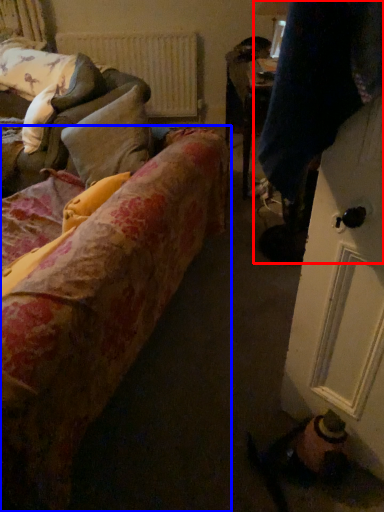
Question: Which object is closer to the camera taking this photo, couple (highlighted by a red box) or studio couch (highlighted by a blue box)?

Choices:
 (A) couple
 (B) studio couch

Answer: (B)